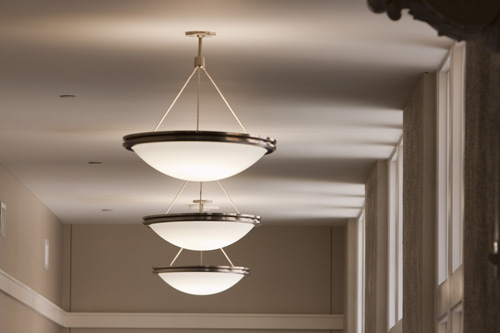
The image size is (500, 333). Identify the location of wall. (288, 275), (16, 219).